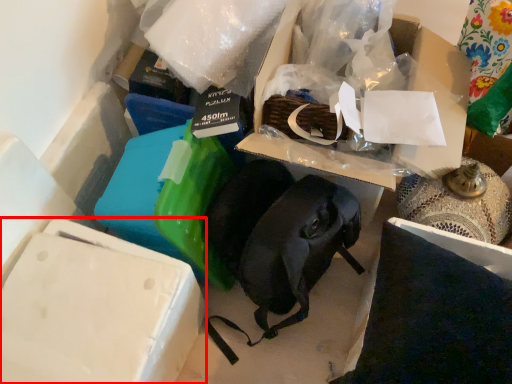
Question: Observing the image, what is the correct spatial positioning of box (annotated by the red box) in reference to storage box?

Choices:
 (A) left
 (B) right

Answer: (A)